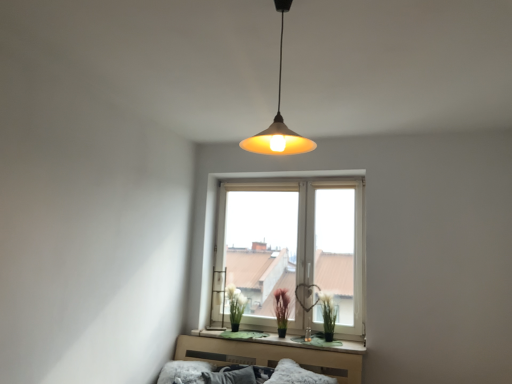
Question: Is white fluffy pillow at lower center, the 1th pillow from the right, bigger than fluffy white pillow at lower center, the second pillow when ordered from right to left?

Choices:
 (A) no
 (B) yes

Answer: (B)

Question: Is white fluffy pillow at lower center, the 1th pillow from the right, to the right of fluffy white pillow at lower center, the 1th pillow from the left, from the viewer's perspective?

Choices:
 (A) no
 (B) yes

Answer: (B)

Question: From the image's perspective, is white fluffy pillow at lower center, which is the 2th pillow from left to right, above fluffy white pillow at lower center, the second pillow when ordered from right to left?

Choices:
 (A) no
 (B) yes

Answer: (B)

Question: Is white fluffy pillow at lower center, which is the 2th pillow from left to right, looking in the opposite direction of fluffy white pillow at lower center, the second pillow when ordered from right to left?

Choices:
 (A) no
 (B) yes

Answer: (A)

Question: Is white fluffy pillow at lower center, the 1th pillow from the right, at the left side of fluffy white pillow at lower center, the second pillow when ordered from right to left?

Choices:
 (A) yes
 (B) no

Answer: (B)

Question: Is white fluffy pillow at lower center, which is the 2th pillow from left to right, not near fluffy white pillow at lower center, the second pillow when ordered from right to left?

Choices:
 (A) yes
 (B) no

Answer: (B)

Question: Does matte yellow plastic lampshade at upper center have a larger size compared to green matte plant at window, which is the 2th plant in left-to-right order?

Choices:
 (A) yes
 (B) no

Answer: (A)

Question: Does matte yellow plastic lampshade at upper center come in front of green matte plant at window, positioned as the 1th plant in right-to-left order?

Choices:
 (A) yes
 (B) no

Answer: (A)

Question: Considering the relative sizes of matte yellow plastic lampshade at upper center and green matte plant at window, positioned as the 1th plant in right-to-left order, in the image provided, is matte yellow plastic lampshade at upper center thinner than green matte plant at window, positioned as the 1th plant in right-to-left order,?

Choices:
 (A) yes
 (B) no

Answer: (B)

Question: Is matte yellow plastic lampshade at upper center outside green matte plant at window, which is the 2th plant in left-to-right order?

Choices:
 (A) no
 (B) yes

Answer: (B)

Question: Are matte yellow plastic lampshade at upper center and green matte plant at window, which is the 2th plant in left-to-right order, far apart?

Choices:
 (A) no
 (B) yes

Answer: (B)

Question: Is matte yellow plastic lampshade at upper center at the right side of green matte plant at window, which is the 2th plant in left-to-right order?

Choices:
 (A) no
 (B) yes

Answer: (A)

Question: From a real-world perspective, is fluffy white pillow at lower center, the second pillow when ordered from right to left, positioned under purple matte plant at center, arranged as the first plant when viewed from the left, based on gravity?

Choices:
 (A) yes
 (B) no

Answer: (A)